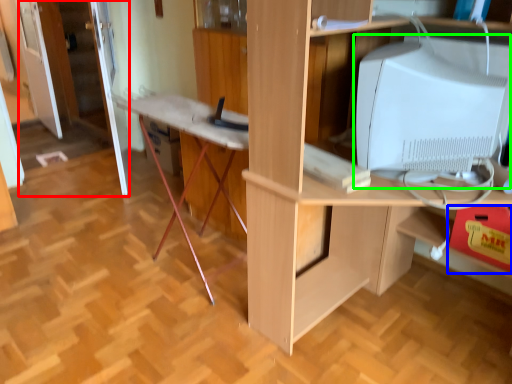
Question: Considering the real-world distances, which object is farthest from door (highlighted by a red box)? drawer (highlighted by a blue box) or computer monitor (highlighted by a green box)?

Choices:
 (A) drawer
 (B) computer monitor

Answer: (A)